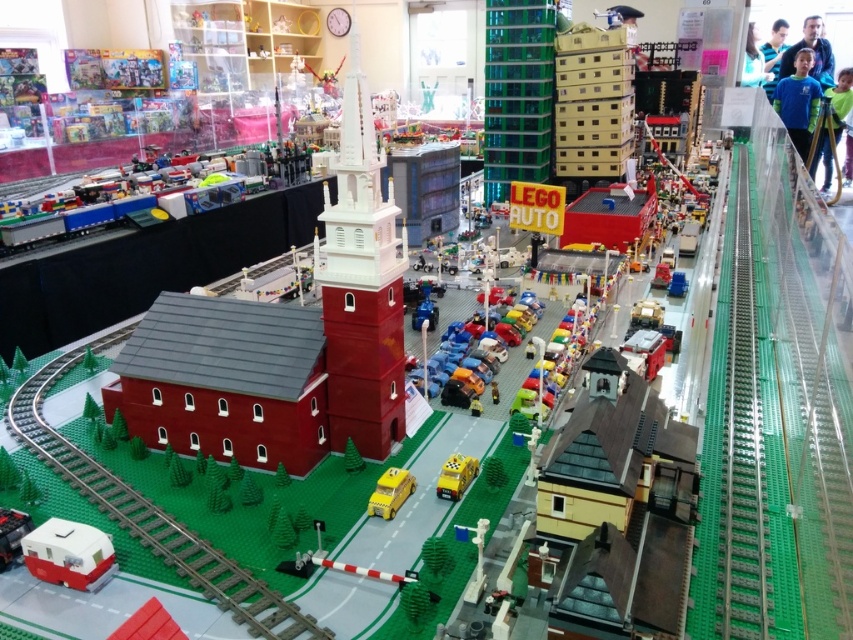
Is matte red church at left taller than yellow plastic taxi at center?

Indeed, matte red church at left has a greater height compared to yellow plastic taxi at center.

Is point (360, 84) farther from viewer compared to point (372, 493)?

No.

At what (x,y) coordinates should I click in order to perform the action: click on matte red church at left. Please return your answer as a coordinate pair (x, y). This screenshot has width=853, height=640. Looking at the image, I should click on (287, 339).

Looking at this image, can you confirm if white matte camper at lower left is thinner than yellow matte taxi at center?

Incorrect, white matte camper at lower left's width is not less than yellow matte taxi at center's.

Is white matte camper at lower left taller than yellow matte taxi at center?

Correct, white matte camper at lower left is much taller as yellow matte taxi at center.

Is point (73, 552) closer to camera compared to point (466, 460)?

Yes, it is in front of point (466, 460).

What are the coordinates of `white matte camper at lower left` in the screenshot? It's located at (68, 554).

Consider the image. Can you confirm if yellow plastic taxi at center is positioned to the right of yellow matte taxi at center?

No, yellow plastic taxi at center is not to the right of yellow matte taxi at center.

How distant is yellow plastic taxi at center from yellow matte taxi at center?

The distance of yellow plastic taxi at center from yellow matte taxi at center is 3.02 inches.

Identify the location of yellow plastic taxi at center. This screenshot has width=853, height=640. (390, 492).